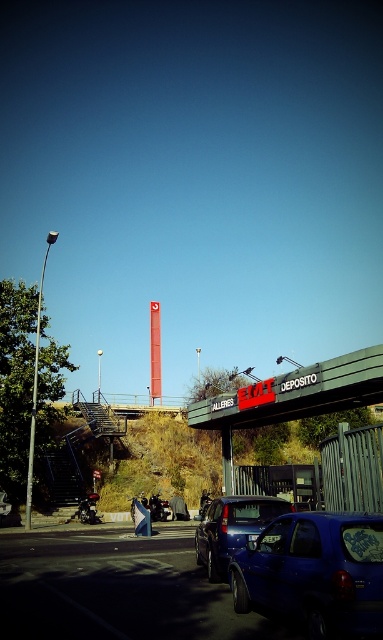
Between silver metallic pole at left and smooth glass tower at center, which one has more height?

silver metallic pole at left is taller.

Measure the distance from silver metallic pole at left to smooth glass tower at center.

silver metallic pole at left is 34.10 meters away from smooth glass tower at center.

At what (x,y) coordinates should I click in order to perform the action: click on silver metallic pole at left. Please return your answer as a coordinate pair (x, y). Image resolution: width=383 pixels, height=640 pixels. Looking at the image, I should click on (36, 387).

Based on the photo, can you confirm if glossy blue car at lower right is positioned below metallic blue sedan at center?

No, glossy blue car at lower right is not below metallic blue sedan at center.

Does glossy blue car at lower right lie in front of metallic blue sedan at center?

Yes, it is in front of metallic blue sedan at center.

Identify the location of glossy blue car at lower right. (314, 572).

Is metallic blue sedan at center wider than silver metallic pole at left?

No, metallic blue sedan at center is not wider than silver metallic pole at left.

Is point (204, 548) behind point (31, 413)?

No.

Locate an element on the screen. metallic blue sedan at center is located at coordinates (232, 529).